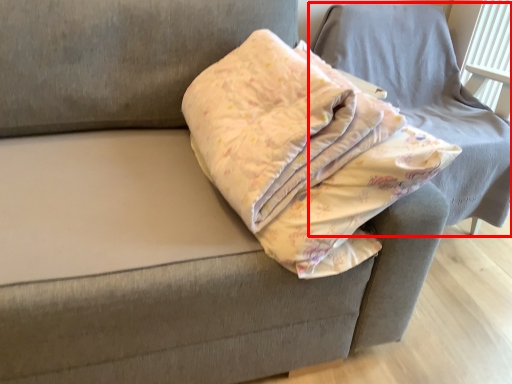
Question: From the image's perspective, where is furniture (annotated by the red box) located in relation to throw pillow in the image?

Choices:
 (A) below
 (B) above

Answer: (B)